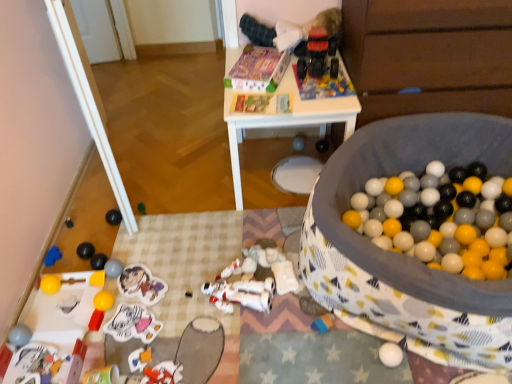
What are the coordinates of `vacant region to the right of matte cardboard stickers at lower center, positioned as the 13th toy in left-to-right order` in the screenshot? It's located at (188, 285).